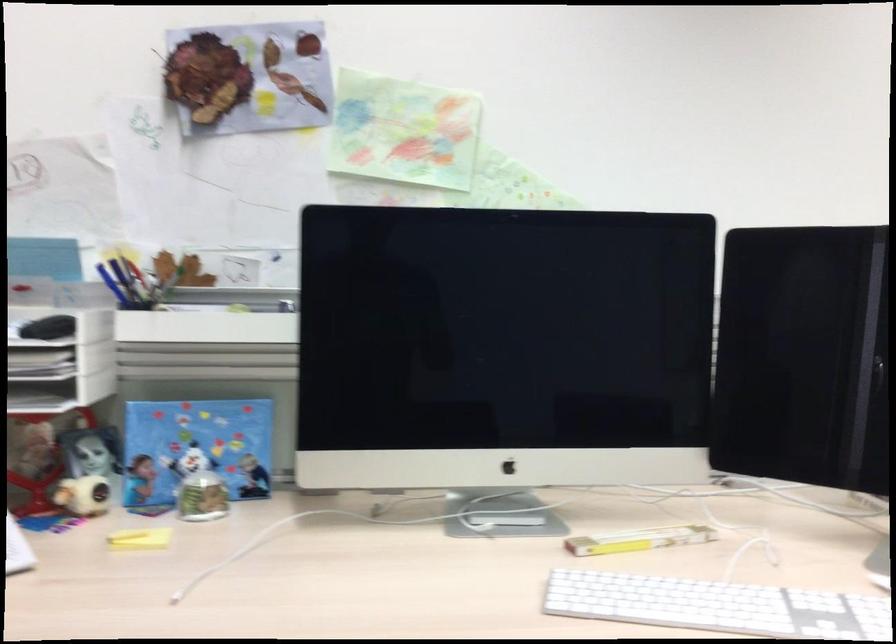
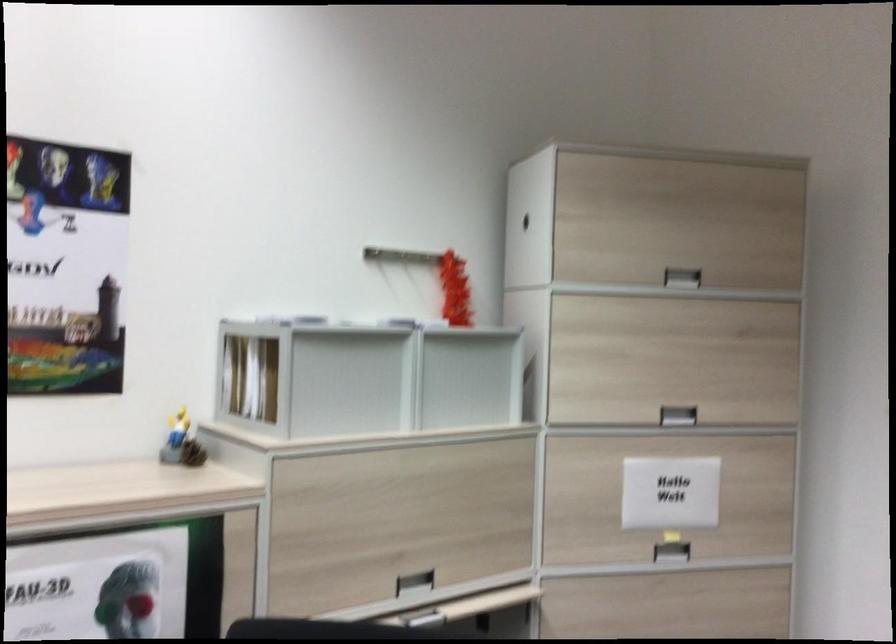
Question: The images are taken continuously from a first-person perspective. In which direction are you moving?

Choices:
 (A) Left
 (B) Right
 (C) Forward
 (D) Backward

Answer: (B)